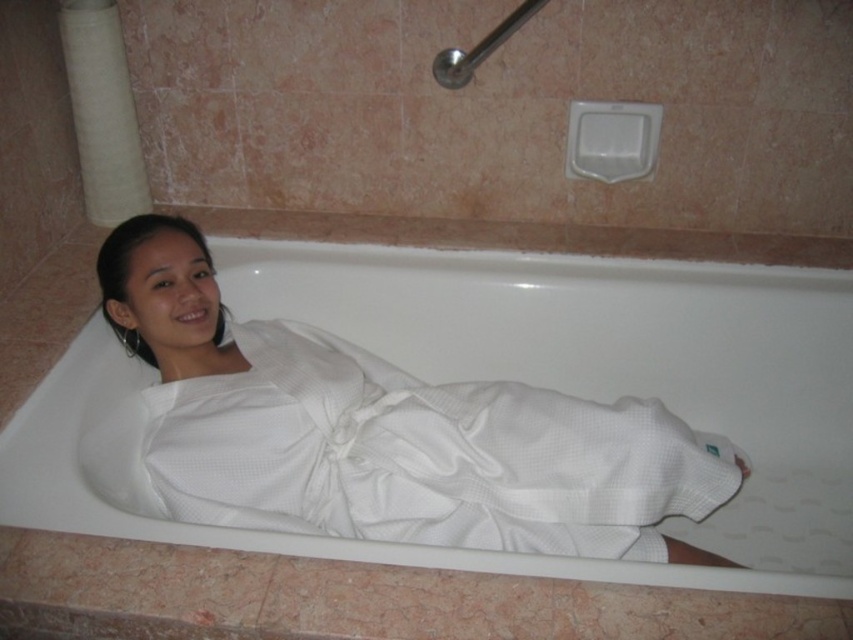
Question: Which object is farther from the camera taking this photo?

Choices:
 (A) white textured bathrobe at center
 (B) white waffle-textured robe at center

Answer: (B)

Question: Is white waffle-textured robe at center further to camera compared to white textured bathrobe at center?

Choices:
 (A) no
 (B) yes

Answer: (B)

Question: Does white waffle-textured robe at center have a lesser width compared to white textured bathrobe at center?

Choices:
 (A) yes
 (B) no

Answer: (B)

Question: Which point is closer to the camera?

Choices:
 (A) (241, 518)
 (B) (177, 531)

Answer: (B)

Question: Is white waffle-textured robe at center positioned behind white textured bathrobe at center?

Choices:
 (A) yes
 (B) no

Answer: (A)